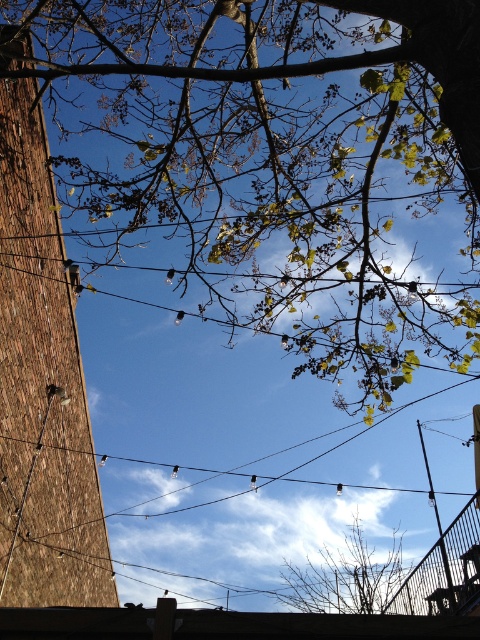
Looking at this image, you are a painter standing at the base of the tree with an easel. You want to paint the scene but need to ensure your canvas can fit both the bare branches at center and the black metal fence at lower right without cropping either. What is the minimum width your canvas should be?

The bare branches at center and the black metal fence at lower right are 4.15 meters apart. Therefore, the minimum width your canvas should be is 4.15 meters to capture both elements without cropping.

You are standing under the tree with bare branches at center and want to look up at the sky. Since the branches are blocking your view, can you estimate how far up you need to look to see the sky clearly?

The bare branches at center are positioned at point (345, 577). To see the sky clearly, you would need to look above this point, approximately 0.719 units up from the bottom of the frame.